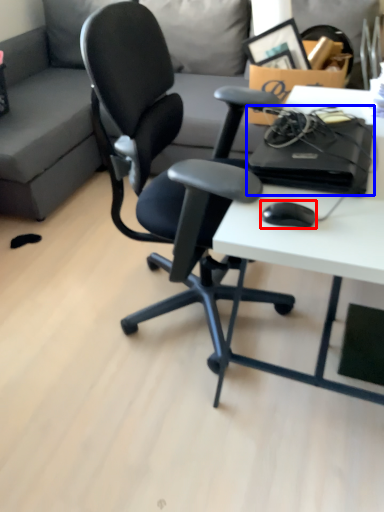
Question: Which object is closer to the camera taking this photo, mouse (highlighted by a red box) or computer (highlighted by a blue box)?

Choices:
 (A) mouse
 (B) computer

Answer: (A)